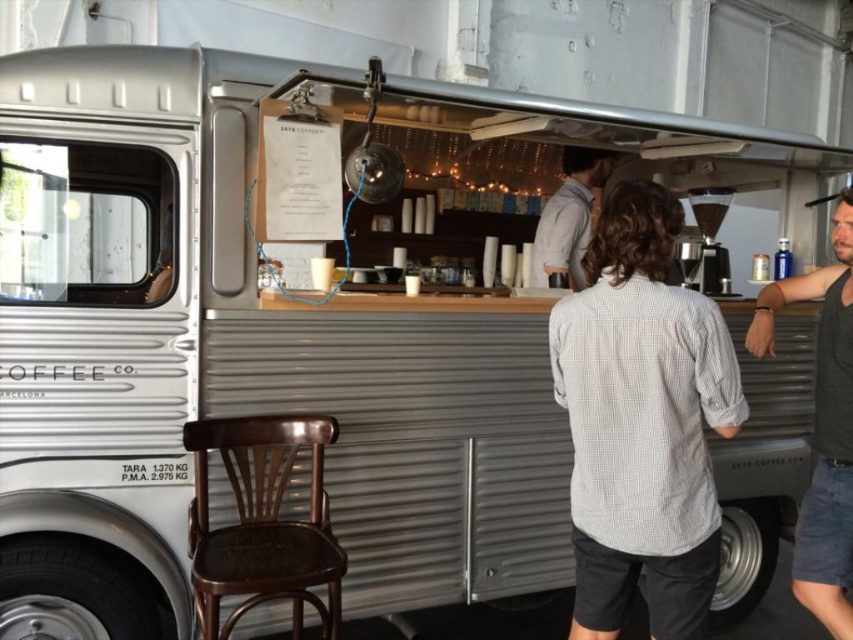
Is point (258, 461) behind point (575, 280)?

No, it is not.

From the picture: Is mahogany wood bar stool at lower left further to camera compared to gray cotton shirt at center?

No, mahogany wood bar stool at lower left is closer to the viewer.

Image resolution: width=853 pixels, height=640 pixels. I want to click on mahogany wood bar stool at lower left, so click(x=262, y=522).

Where is `mahogany wood bar stool at lower left`? Image resolution: width=853 pixels, height=640 pixels. mahogany wood bar stool at lower left is located at coordinates (262, 522).

Is white checkered shirt at center positioned in front of dark gray tank top at right?

That is True.

Measure the distance between white checkered shirt at center and camera.

A distance of 1.77 meters exists between white checkered shirt at center and camera.

The width and height of the screenshot is (853, 640). Describe the element at coordinates (642, 420) in the screenshot. I see `white checkered shirt at center` at that location.

What are the coordinates of `white checkered shirt at center` in the screenshot? It's located at [642, 420].

Which is behind, point (672, 545) or point (299, 557)?

Point (299, 557)

Between point (621, 608) and point (234, 538), which one is positioned in front?

Positioned in front is point (621, 608).

Is point (676, 208) positioned before point (252, 481)?

Yes, it is.

Locate an element on the screen. white checkered shirt at center is located at coordinates (642, 420).